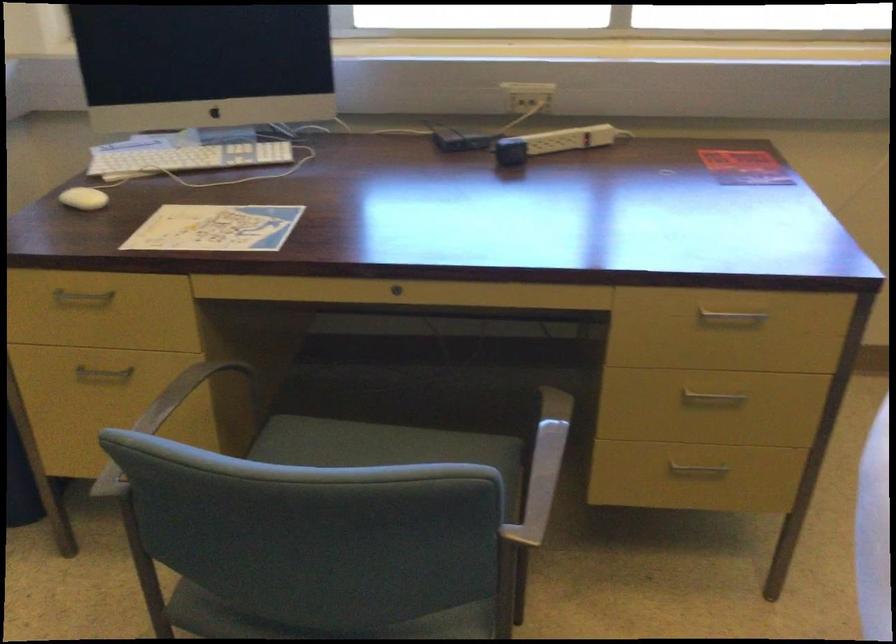
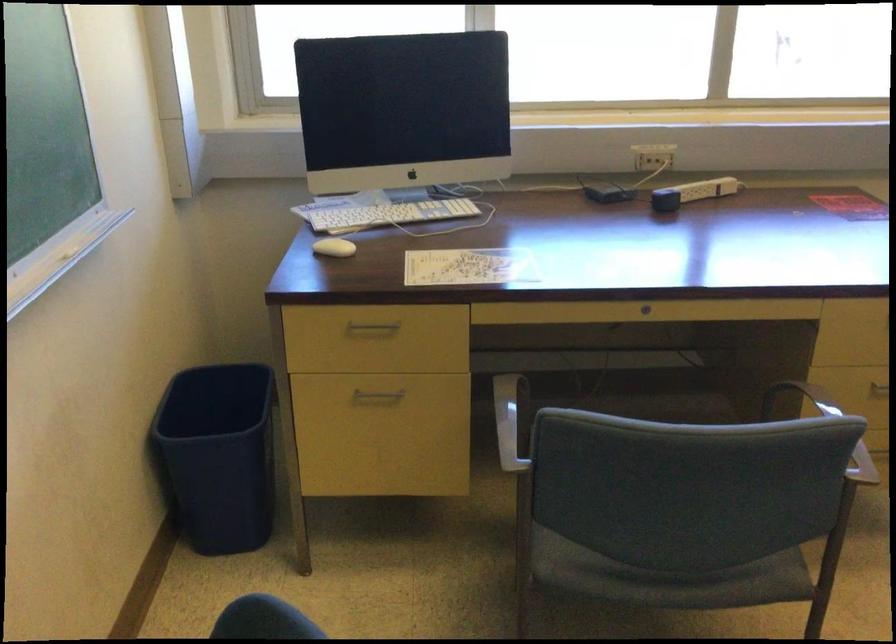
In the second image, find the point that corresponds to (509,100) in the first image.

(643, 158)